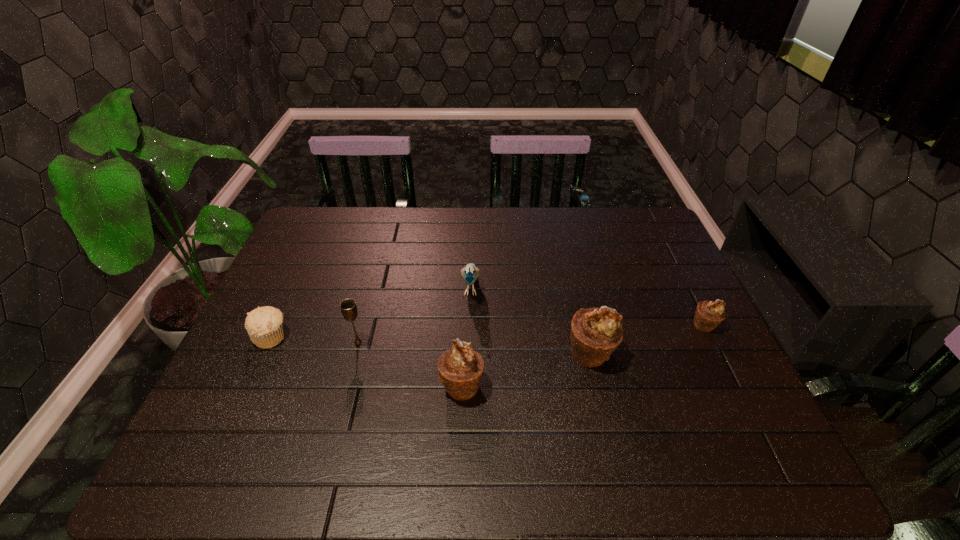
At what (x,y) coordinates should I click in order to perform the action: click on empty space between the second muffin from left to right and the leftmost object. Please return your answer as a coordinate pair (x, y). Looking at the image, I should click on (367, 361).

Where is `vacant area that lies between the leftmost object and the rightmost object`? vacant area that lies between the leftmost object and the rightmost object is located at coordinates (488, 331).

This screenshot has width=960, height=540. I want to click on unoccupied position between the leftmost object and the rightmost object, so click(x=488, y=331).

Identify the location of vacant point located between the bird and the leftmost muffin. (372, 312).

In order to click on vacant space that's between the third shortest muffin and the chalice in this screenshot , I will do `click(410, 364)`.

I want to click on free area in between the third muffin from left to right and the third muffin from right to left, so click(526, 369).

Find the location of `free space between the rightmost object and the leftmost object`. free space between the rightmost object and the leftmost object is located at coordinates (488, 331).

This screenshot has width=960, height=540. In order to click on vacant area between the fifth object from right to left and the rightmost object in this screenshot , I will do pyautogui.click(x=531, y=334).

Where is `vacant space in between the second muffin from left to right and the chalice`? The width and height of the screenshot is (960, 540). vacant space in between the second muffin from left to right and the chalice is located at coordinates (410, 364).

The width and height of the screenshot is (960, 540). Find the location of `unoccupied area between the farthest object and the second object from right to left`. unoccupied area between the farthest object and the second object from right to left is located at coordinates (x=531, y=320).